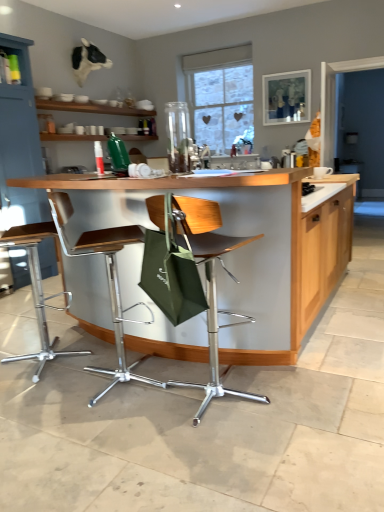
Question: From the image's perspective, is wooden countertop at center located beneath metallic silver stool at center, positioned as the second chair in left-to-right order?

Choices:
 (A) yes
 (B) no

Answer: (B)

Question: Is wooden countertop at center oriented away from metallic silver stool at center, positioned as the second chair in left-to-right order?

Choices:
 (A) no
 (B) yes

Answer: (B)

Question: Does wooden countertop at center have a greater width compared to metallic silver stool at center, positioned as the second chair in left-to-right order?

Choices:
 (A) yes
 (B) no

Answer: (A)

Question: Is metallic silver stool at center, positioned as the second chair in left-to-right order, inside wooden countertop at center?

Choices:
 (A) no
 (B) yes

Answer: (B)

Question: Is wooden countertop at center aimed at metallic silver stool at center, which is the second chair in right-to-left order?

Choices:
 (A) yes
 (B) no

Answer: (B)

Question: Considering the relative sizes of wooden countertop at center and metallic silver stool at center, which is the second chair in right-to-left order, in the image provided, is wooden countertop at center taller than metallic silver stool at center, which is the second chair in right-to-left order,?

Choices:
 (A) no
 (B) yes

Answer: (B)

Question: Is matte blue cabinet at upper left next to transparent glass vase at center?

Choices:
 (A) yes
 (B) no

Answer: (B)

Question: Is matte blue cabinet at upper left aimed at transparent glass vase at center?

Choices:
 (A) yes
 (B) no

Answer: (A)

Question: Is matte blue cabinet at upper left oriented away from transparent glass vase at center?

Choices:
 (A) no
 (B) yes

Answer: (A)

Question: From a real-world perspective, is matte blue cabinet at upper left physically above transparent glass vase at center?

Choices:
 (A) yes
 (B) no

Answer: (B)

Question: Is the depth of matte blue cabinet at upper left greater than that of transparent glass vase at center?

Choices:
 (A) yes
 (B) no

Answer: (A)

Question: From the image's perspective, is matte blue cabinet at upper left over transparent glass vase at center?

Choices:
 (A) yes
 (B) no

Answer: (A)

Question: Does metallic silver stool at center, which is the second chair in right-to-left order, have a greater height compared to matte blue cabinet at upper left?

Choices:
 (A) no
 (B) yes

Answer: (A)